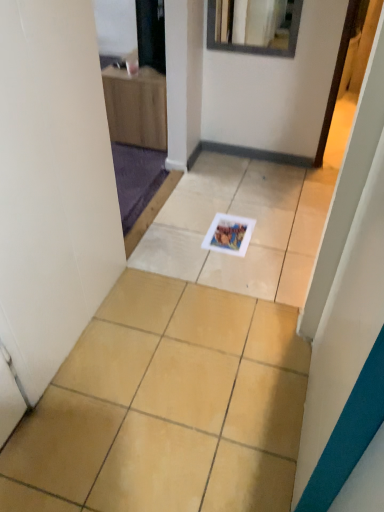
This screenshot has width=384, height=512. I want to click on vacant space situated above beige ceramic tile at center (from a real-world perspective), so click(x=216, y=294).